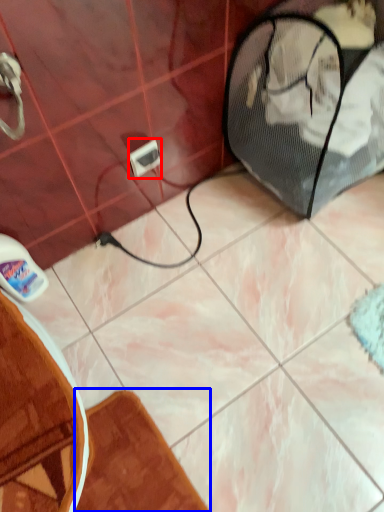
Question: Which of the following is the farthest to the observer, electric outlet (highlighted by a red box) or bath mat (highlighted by a blue box)?

Choices:
 (A) electric outlet
 (B) bath mat

Answer: (A)